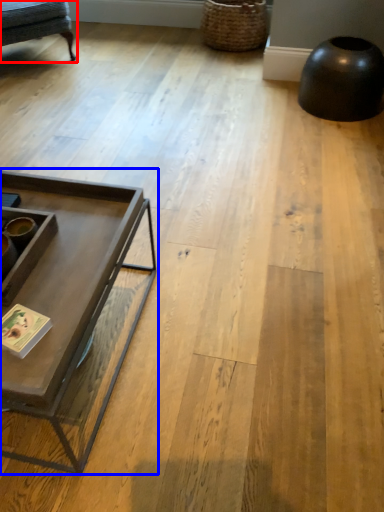
Question: Which of the following is the closest to the observer, swivel chair (highlighted by a red box) or coffee table (highlighted by a blue box)?

Choices:
 (A) swivel chair
 (B) coffee table

Answer: (B)